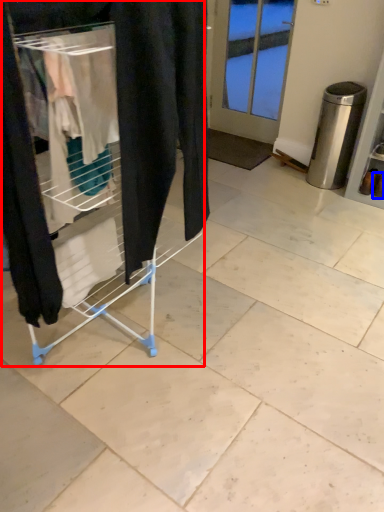
Question: Among these objects, which one is nearest to the camera, furniture (highlighted by a red box) or footwear (highlighted by a blue box)?

Choices:
 (A) furniture
 (B) footwear

Answer: (A)